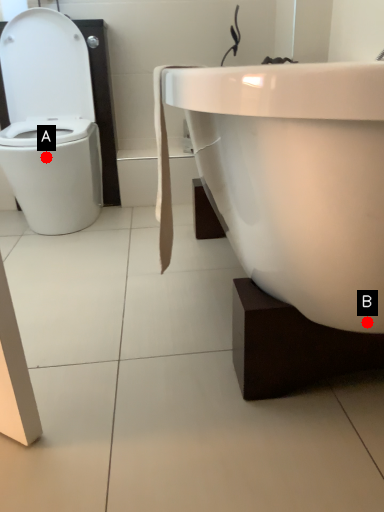
Question: Two points are circled on the image, labeled by A and B beside each circle. Which point appears farthest from the camera in this image?

Choices:
 (A) A is further
 (B) B is further

Answer: (A)